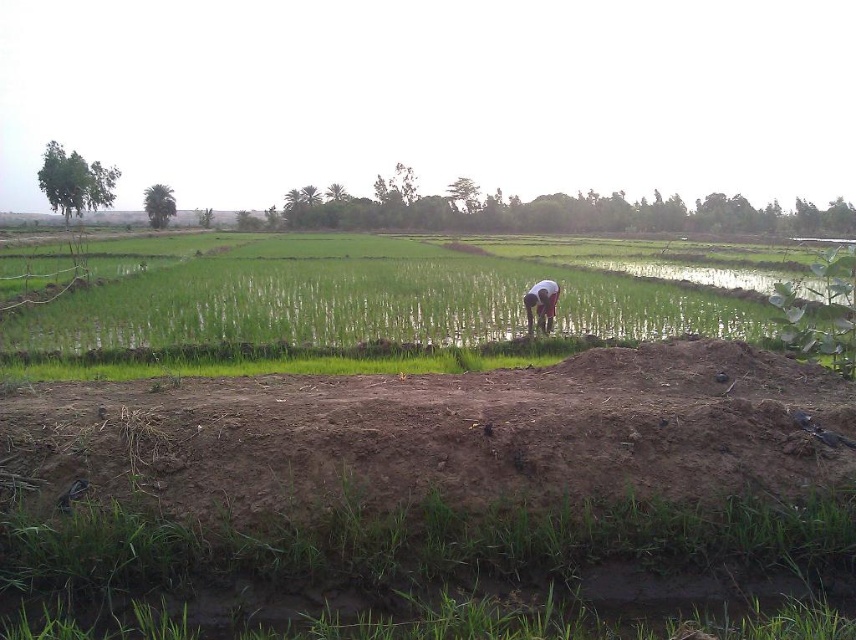
You are standing on the raised dirt embankment in the foreground of the rice paddy scene. You notice a person working in the middle ground. Which direction should you walk to reach the green grass at center before reaching the dark brown skin at center?

You should walk to the left because the green grass at center is located to the left of the dark brown skin at center, so you can reach it first by moving in that direction.

You are a farmer who wants to cross the raised dirt embankment. You notice green grass at center and dark brown skin at center. Which part of the embankment is safer to step on?

The dark brown skin at center is safer to step on because the green grass at center is much taller and may be unstable or slippery due to its height and growth.